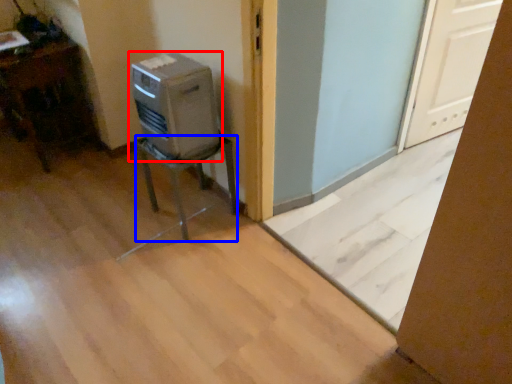
Question: Which point is closer to the camera, home appliance (highlighted by a red box) or furniture (highlighted by a blue box)?

Choices:
 (A) home appliance
 (B) furniture

Answer: (A)